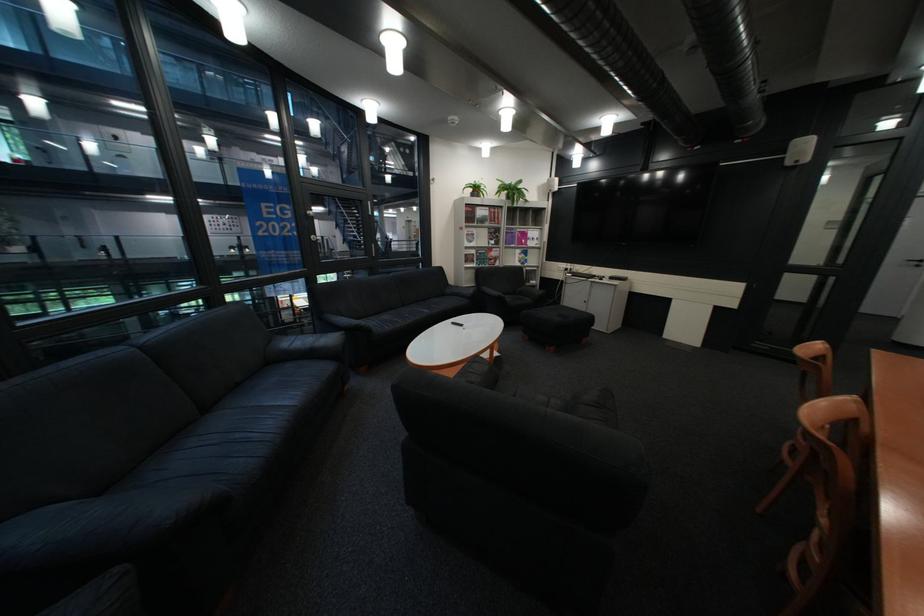
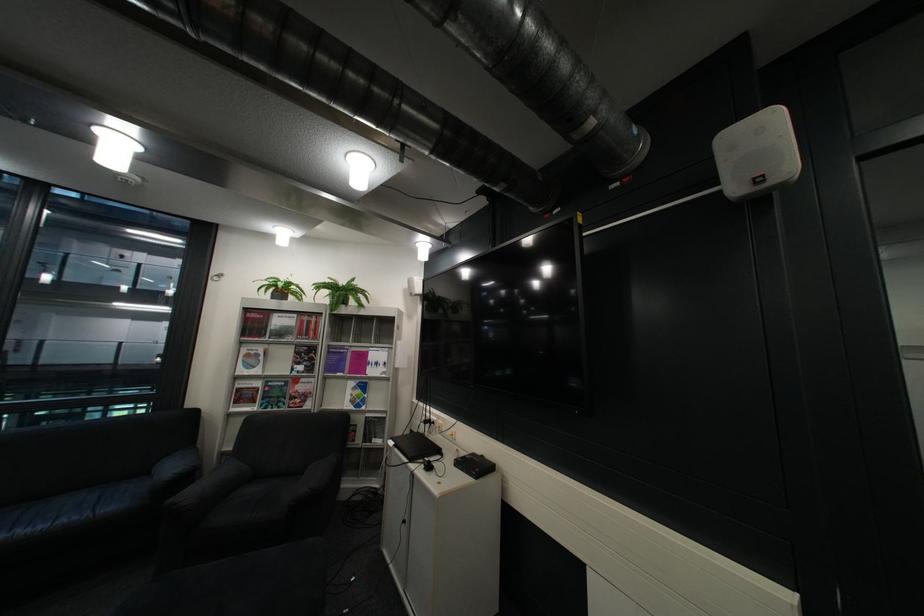
The point at (481, 211) is marked in the first image. Where is the corresponding point in the second image?

(260, 320)